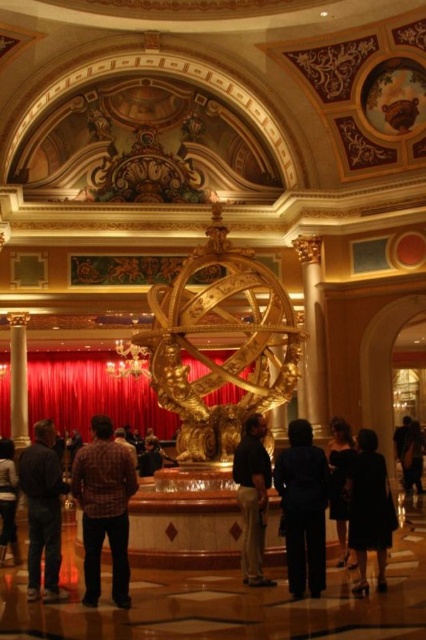
Question: Which point is closer to the camera?

Choices:
 (A) (132, 477)
 (B) (357, 580)
 (C) (287, 531)
 (D) (5, 460)

Answer: (A)

Question: Among these points, which one is farthest from the camera?

Choices:
 (A) (31, 600)
 (B) (273, 394)

Answer: (B)

Question: Is gold polished sphere at center bigger than black silk dress at center?

Choices:
 (A) no
 (B) yes

Answer: (B)

Question: Is dark gray pants at lower left positioned at the back of dark fabric dress at lower right?

Choices:
 (A) yes
 (B) no

Answer: (A)

Question: Can you confirm if black fabric pants at center is positioned above dark brown leather pants at center?

Choices:
 (A) yes
 (B) no

Answer: (B)

Question: Which point appears closest to the camera in this image?

Choices:
 (A) (13, 464)
 (B) (95, 515)

Answer: (B)